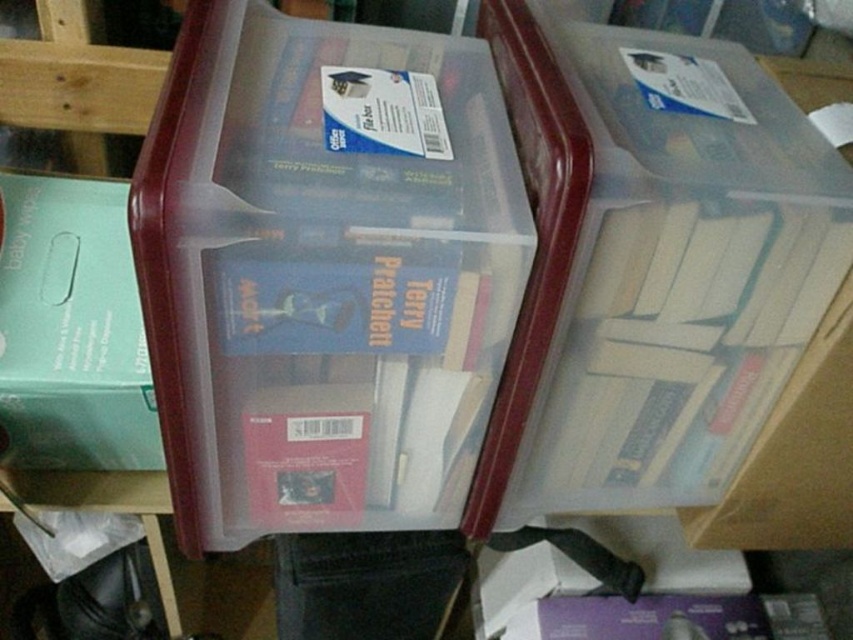
Please provide the coordinates of the transparent plastic box at center in the image.

The transparent plastic box at center is located at coordinates point (322, 276).

You are organizing books on a shelf and need to place a new book between the transparent plastic box at center and the clear plastic box at upper right. Which box should you place the new book closer to if you want it to be closer to the shorter one?

The transparent plastic box at center is shorter than the clear plastic box at upper right, so you should place the new book closer to the transparent plastic box at center.